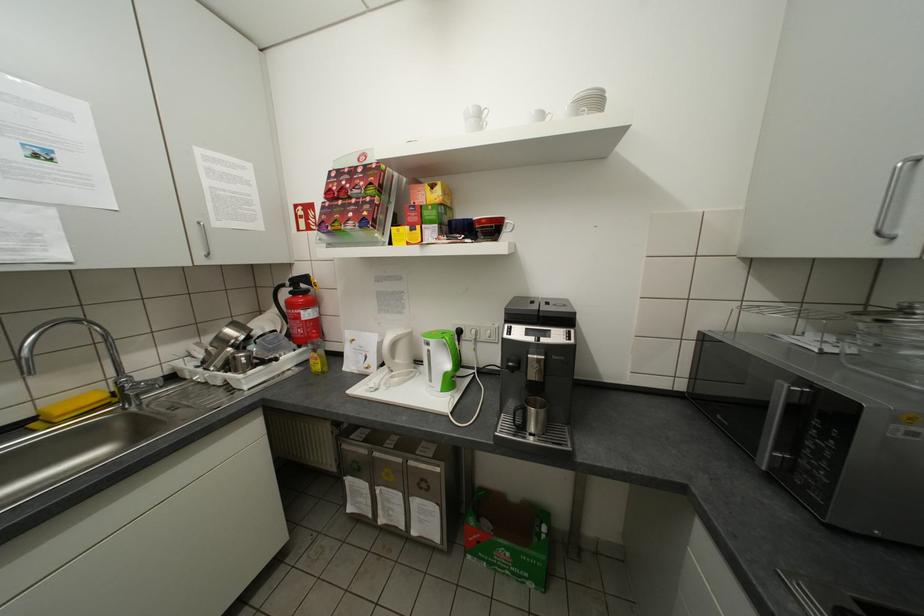
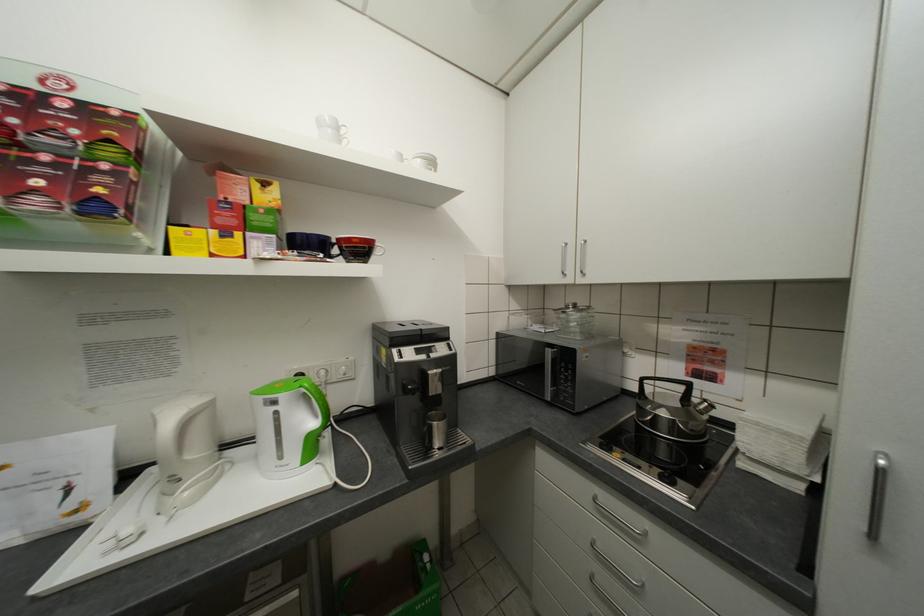
Question: The camera is either moving clockwise (left) or counter-clockwise (right) around the object. The first image is from the beginning of the video and the second image is from the end. Is the camera moving left or right when shooting the video?

Choices:
 (A) Left
 (B) Right

Answer: (A)